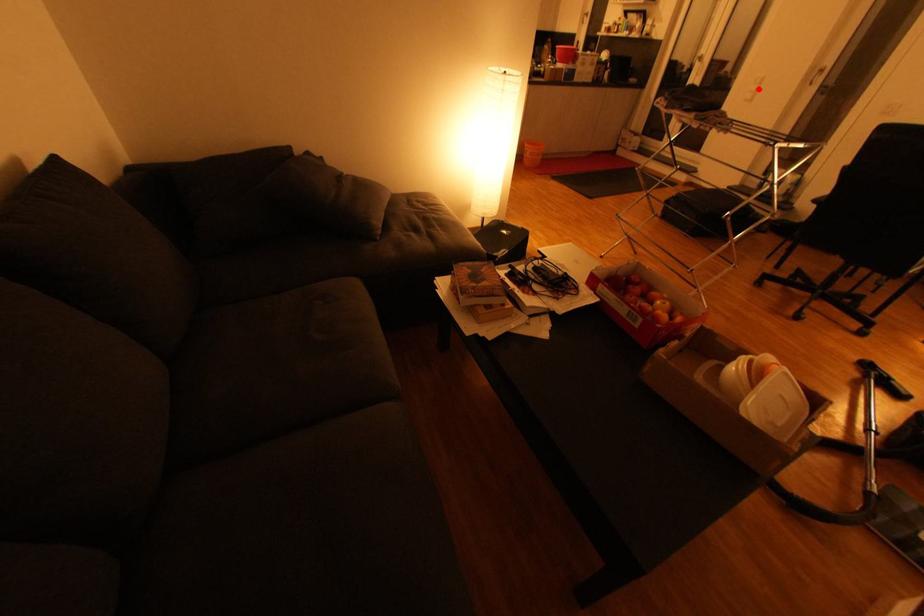
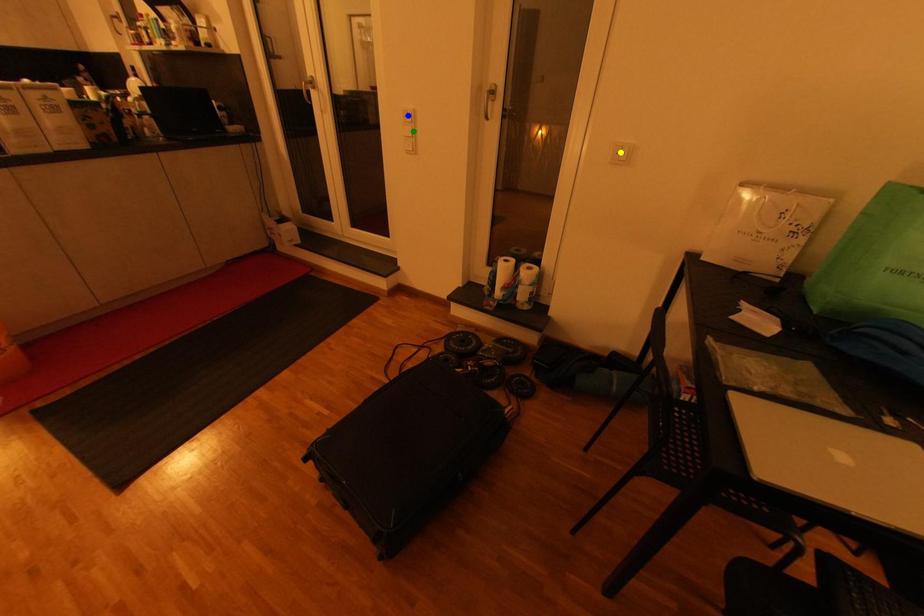
Question: I am providing you with two images of the same scene from different viewpoints. A red point is marked on the first image. You are given multiple points on the second image. Which point in image 2 represents the same 3d spot as the red point in image 1?

Choices:
 (A) blue point
 (B) yellow point
 (C) green point

Answer: (C)